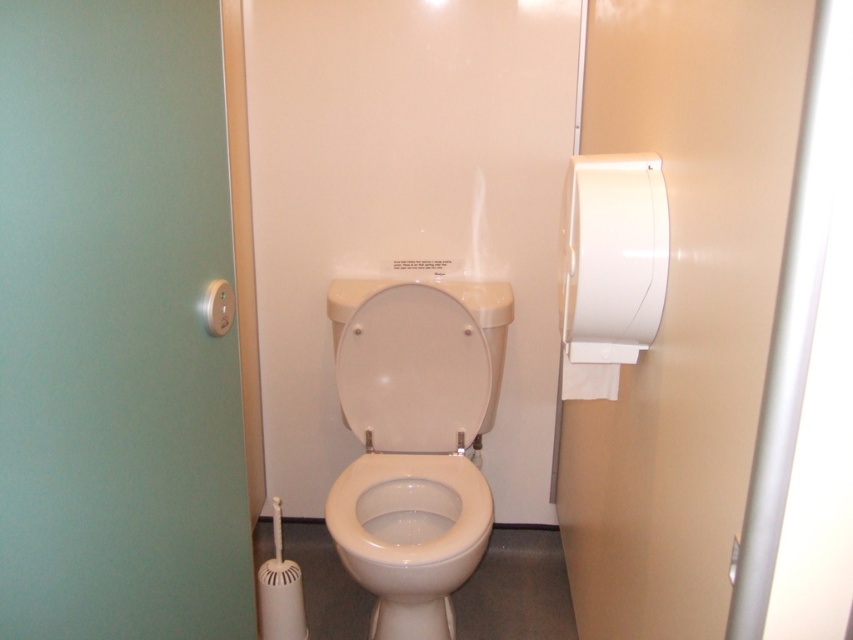
Is white glossy toilet lid at center wider than white matte toilet paper at right?

Correct, the width of white glossy toilet lid at center exceeds that of white matte toilet paper at right.

Who is positioned more to the right, white glossy toilet lid at center or white matte toilet paper at right?

Positioned to the right is white matte toilet paper at right.

The image size is (853, 640). What do you see at coordinates (412, 364) in the screenshot?
I see `white glossy toilet lid at center` at bounding box center [412, 364].

Locate an element on the screen. white glossy toilet lid at center is located at coordinates (412, 364).

Which is in front, point (395, 292) or point (601, 316)?

Point (601, 316) is in front.

Is white glossy toilet at center closer to the viewer compared to white matte toilet paper at right?

No, white glossy toilet at center is further to the viewer.

Does point (460, 502) come behind point (608, 173)?

Yes.

You are a GUI agent. You are given a task and a screenshot of the screen. Output one action in this format:
    pyautogui.click(x=<x>, y=<y>)
    Task: Click on the white glossy toilet at center
    
    Given the screenshot: What is the action you would take?
    pyautogui.click(x=415, y=440)

Is the position of white glossy toilet bowl at center more distant than that of white matte toilet paper at right?

Yes.

The height and width of the screenshot is (640, 853). In order to click on white glossy toilet bowl at center in this screenshot , I will do `click(410, 536)`.

The image size is (853, 640). What do you see at coordinates (410, 536) in the screenshot? I see `white glossy toilet bowl at center` at bounding box center [410, 536].

You are a GUI agent. You are given a task and a screenshot of the screen. Output one action in this format:
    pyautogui.click(x=<x>, y=<y>)
    Task: Click on the white glossy toilet bowl at center
    The height and width of the screenshot is (640, 853).
    Given the screenshot: What is the action you would take?
    pyautogui.click(x=410, y=536)